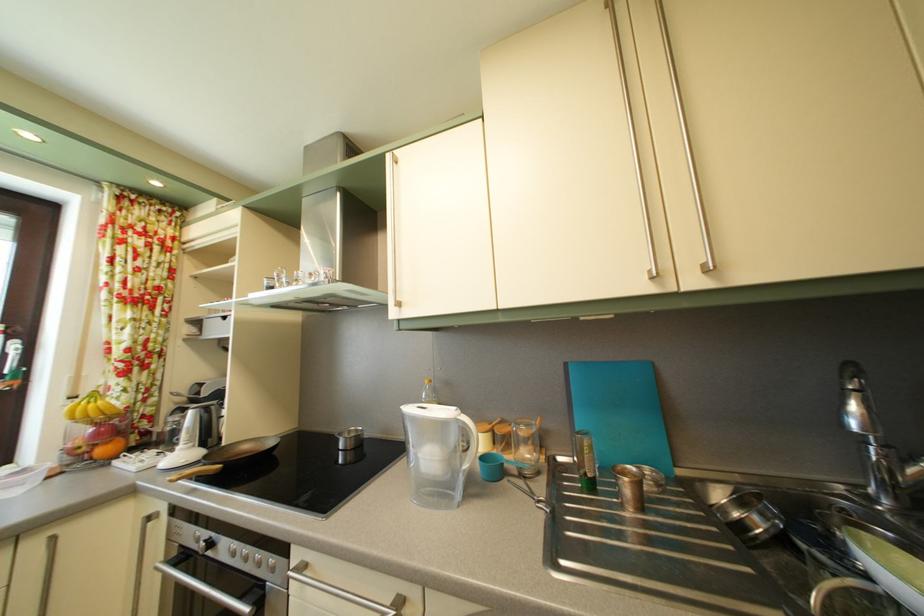
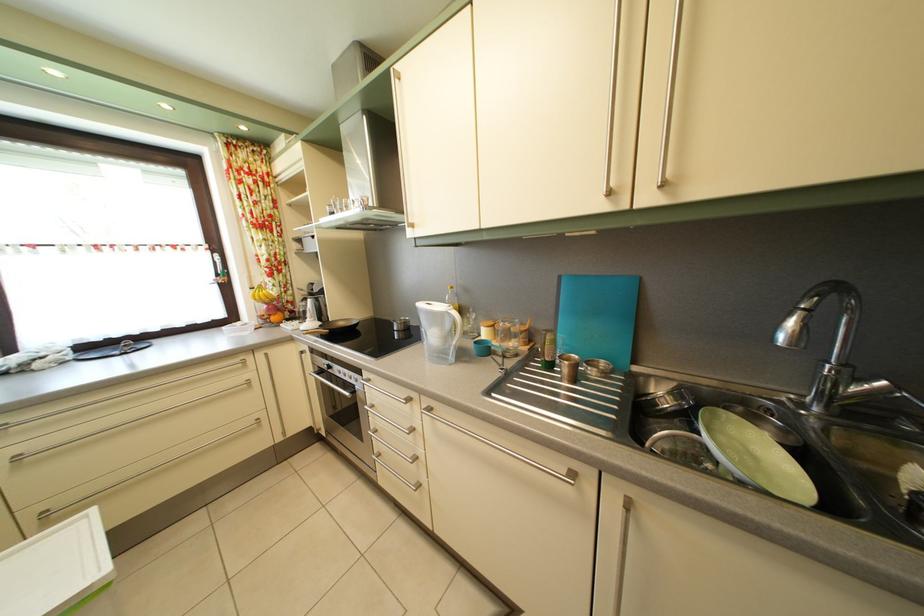
The point at (x=281, y=567) is marked in the first image. Where is the corresponding point in the second image?

(365, 384)